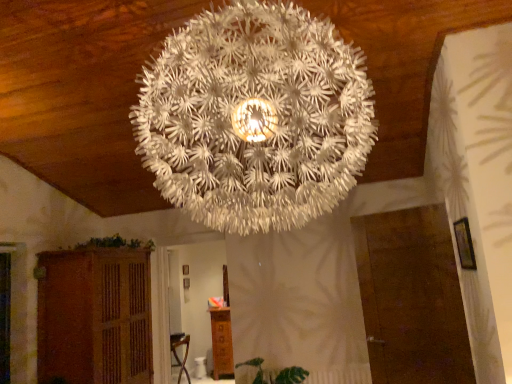
Describe the element at coordinates (255, 117) in the screenshot. I see `white textured lamp at center` at that location.

I want to click on green leafy plant at lower left, acting as the 2th plant starting from the bottom, so click(x=116, y=243).

What do you see at coordinates (221, 343) in the screenshot? The image size is (512, 384). I see `wooden cabinet at lower center, which is the second furniture in left-to-right order` at bounding box center [221, 343].

The image size is (512, 384). I want to click on green leafy plant at lower center, marked as the 1th plant in a right-to-left arrangement, so click(276, 374).

Considering the sizes of objects green leafy plant at lower center, the 1th plant when ordered from bottom to top, and wooden cabinet at lower center, which is counted as the first furniture, starting from the back, in the image provided, who is taller, green leafy plant at lower center, the 1th plant when ordered from bottom to top, or wooden cabinet at lower center, which is counted as the first furniture, starting from the back,?

wooden cabinet at lower center, which is counted as the first furniture, starting from the back.

Is green leafy plant at lower center, the 1th plant when ordered from bottom to top, looking in the opposite direction of wooden cabinet at lower center, which is the second furniture in left-to-right order?

Yes, wooden cabinet at lower center, which is the second furniture in left-to-right order, is at the back of green leafy plant at lower center, the 1th plant when ordered from bottom to top.

Is point (297, 366) positioned in front of point (214, 323)?

Yes, point (297, 366) is closer to viewer.

In terms of size, does green leafy plant at lower center, marked as the 1th plant in a right-to-left arrangement, appear bigger or smaller than wooden cabinet at lower center, which is counted as the first furniture, starting from the back?

green leafy plant at lower center, marked as the 1th plant in a right-to-left arrangement, is smaller than wooden cabinet at lower center, which is counted as the first furniture, starting from the back.

Between white textured lamp at center and green leafy plant at lower center, the 2th plant positioned from the left, which one has less height?

green leafy plant at lower center, the 2th plant positioned from the left, is shorter.

From a real-world perspective, is white textured lamp at center positioned over green leafy plant at lower center, which ranks as the 2th plant in top-to-bottom order, based on gravity?

Yes.

From the image's perspective, is white textured lamp at center under green leafy plant at lower center, the 2th plant positioned from the left?

Incorrect, from the image's perspective, white textured lamp at center is higher than green leafy plant at lower center, the 2th plant positioned from the left.

You are a GUI agent. You are given a task and a screenshot of the screen. Output one action in this format:
    pyautogui.click(x=<x>, y=<y>)
    Task: Click on the plant below the green leafy plant at lower left, placed as the 1th plant when sorted from top to bottom (from the image's perspective)
    The width and height of the screenshot is (512, 384).
    Given the screenshot: What is the action you would take?
    pyautogui.click(x=276, y=374)

Is point (93, 242) closer or farther from the camera than point (256, 375)?

Point (93, 242) is closer to the camera than point (256, 375).

Is green leafy plant at lower center, which ranks as the 2th plant in top-to-bottom order, a part of green leafy plant at lower left, which is the second plant from right to left?

No, green leafy plant at lower center, which ranks as the 2th plant in top-to-bottom order, is not inside green leafy plant at lower left, which is the second plant from right to left.

Is green leafy plant at lower left, acting as the 2th plant starting from the bottom, smaller than green leafy plant at lower center, the 2th plant positioned from the left?

Incorrect, green leafy plant at lower left, acting as the 2th plant starting from the bottom, is not smaller in size than green leafy plant at lower center, the 2th plant positioned from the left.

Which of these two, brown wooden cabinet at lower left, the 1th furniture viewed from the left, or green leafy plant at lower left, placed as the 1th plant when sorted from top to bottom, is bigger?

brown wooden cabinet at lower left, the 1th furniture viewed from the left.

Who is taller, brown wooden cabinet at lower left, the first furniture from the front, or green leafy plant at lower left, placed as the 1th plant when sorted from top to bottom?

brown wooden cabinet at lower left, the first furniture from the front, is taller.

The image size is (512, 384). In order to click on furniture on the left of green leafy plant at lower left, which is the second plant from right to left in this screenshot , I will do `click(94, 316)`.

From a real-world perspective, is wooden cabinet at lower center, which is counted as the 2th furniture, starting from the front, physically above green leafy plant at lower center, which ranks as the 2th plant in top-to-bottom order?

Incorrect, from a real-world perspective, wooden cabinet at lower center, which is counted as the 2th furniture, starting from the front, is lower than green leafy plant at lower center, which ranks as the 2th plant in top-to-bottom order.

Is wooden cabinet at lower center, which is counted as the first furniture, starting from the back, turned away from green leafy plant at lower center, which ranks as the 2th plant in top-to-bottom order?

That's not correct — wooden cabinet at lower center, which is counted as the first furniture, starting from the back, is not looking away from green leafy plant at lower center, which ranks as the 2th plant in top-to-bottom order.

Is wooden cabinet at lower center, which is the second furniture in left-to-right order, spatially inside green leafy plant at lower center, marked as the 1th plant in a right-to-left arrangement, or outside of it?

The correct answer is: outside.

Is wooden cabinet at lower center, which is counted as the 2th furniture, starting from the front, facing away from brown wooden cabinet at lower left, the 1th furniture viewed from the left?

No, wooden cabinet at lower center, which is counted as the 2th furniture, starting from the front, is not facing the opposite direction of brown wooden cabinet at lower left, the 1th furniture viewed from the left.

Which of these two, wooden cabinet at lower center, which is the second furniture in left-to-right order, or brown wooden cabinet at lower left, which appears as the 2th furniture when viewed from the back, stands shorter?

wooden cabinet at lower center, which is the second furniture in left-to-right order, is shorter.

Locate an element on the screen. This screenshot has width=512, height=384. furniture located underneath the brown wooden cabinet at lower left, which appears as the 2th furniture when viewed from the back (from a real-world perspective) is located at coordinates (221, 343).

Is the depth of wooden cabinet at lower center, which is the second furniture in left-to-right order, greater than that of brown wooden cabinet at lower left, the first furniture from the front?

Yes, wooden cabinet at lower center, which is the second furniture in left-to-right order, is behind brown wooden cabinet at lower left, the first furniture from the front.

From the image's perspective, is green leafy plant at lower left, which is the second plant from right to left, on top of brown wooden cabinet at lower left, acting as the second furniture starting from the right?

Indeed, from the image's perspective, green leafy plant at lower left, which is the second plant from right to left, is shown above brown wooden cabinet at lower left, acting as the second furniture starting from the right.

Identify the location of the 2nd plant behind the brown wooden cabinet at lower left, acting as the second furniture starting from the right, counting from the anchor's position. The width and height of the screenshot is (512, 384). (116, 243).

From a real-world perspective, which is physically below, green leafy plant at lower left, acting as the 2th plant starting from the bottom, or brown wooden cabinet at lower left, the first furniture from the front?

brown wooden cabinet at lower left, the first furniture from the front, is physically lower.

Locate an element on the screen. The width and height of the screenshot is (512, 384). furniture below the green leafy plant at lower center, the 2th plant positioned from the left (from the image's perspective) is located at coordinates (221, 343).

Locate an element on the screen. plant that is the 2nd one below the white textured lamp at center (from a real-world perspective) is located at coordinates (276, 374).

When comparing their distances from white textured lamp at center, does green leafy plant at lower left, placed as the 1th plant when sorted from top to bottom, or wooden cabinet at lower center, which is counted as the first furniture, starting from the back, seem closer?

Among the two, green leafy plant at lower left, placed as the 1th plant when sorted from top to bottom, is located nearer to white textured lamp at center.

Looking at the image, which one is located closer to white textured lamp at center, green leafy plant at lower center, the 1th plant when ordered from bottom to top, or wooden cabinet at lower center, which is counted as the first furniture, starting from the back?

green leafy plant at lower center, the 1th plant when ordered from bottom to top.

When comparing their distances from brown wooden cabinet at lower left, acting as the second furniture starting from the right, does wooden cabinet at lower center, which is the second furniture in left-to-right order, or green leafy plant at lower left, the first plant from the left, seem closer?

green leafy plant at lower left, the first plant from the left, is closer to brown wooden cabinet at lower left, acting as the second furniture starting from the right.

When comparing their distances from wooden cabinet at lower center, which is counted as the first furniture, starting from the back, does brown wooden cabinet at lower left, acting as the second furniture starting from the right, or green leafy plant at lower left, which is the second plant from right to left, seem further?

green leafy plant at lower left, which is the second plant from right to left.

Based on the photo, considering their positions, is green leafy plant at lower left, acting as the 2th plant starting from the bottom, positioned further to wooden cabinet at lower center, which is counted as the first furniture, starting from the back, than green leafy plant at lower center, which ranks as the 2th plant in top-to-bottom order?

Based on the image, green leafy plant at lower left, acting as the 2th plant starting from the bottom, appears to be further to wooden cabinet at lower center, which is counted as the first furniture, starting from the back.

When comparing their distances from brown wooden cabinet at lower left, the 1th furniture viewed from the left, does green leafy plant at lower center, marked as the 1th plant in a right-to-left arrangement, or white textured lamp at center seem closer?

green leafy plant at lower center, marked as the 1th plant in a right-to-left arrangement.

Estimate the real-world distances between objects in this image. Which object is closer to green leafy plant at lower center, which ranks as the 2th plant in top-to-bottom order, brown wooden cabinet at lower left, the 1th furniture viewed from the left, or green leafy plant at lower left, which is the second plant from right to left?

brown wooden cabinet at lower left, the 1th furniture viewed from the left.

Looking at this image, estimate the real-world distances between objects in this image. Which object is further from green leafy plant at lower left, the first plant from the left, white textured lamp at center or wooden cabinet at lower center, which is the second furniture in left-to-right order?

white textured lamp at center.

Locate an element on the screen. Image resolution: width=512 pixels, height=384 pixels. plant between white textured lamp at center and green leafy plant at lower left, placed as the 1th plant when sorted from top to bottom, in the front-back direction is located at coordinates (276, 374).

Locate an element on the screen. furniture located between white textured lamp at center and wooden cabinet at lower center, which is counted as the 2th furniture, starting from the front, in the depth direction is located at coordinates coord(94,316).

Identify the location of furniture between white textured lamp at center and green leafy plant at lower left, placed as the 1th plant when sorted from top to bottom, in the front-back direction. The width and height of the screenshot is (512, 384). (94, 316).

This screenshot has width=512, height=384. Identify the location of plant between brown wooden cabinet at lower left, which appears as the 2th furniture when viewed from the back, and green leafy plant at lower center, which ranks as the 2th plant in top-to-bottom order. (116, 243).